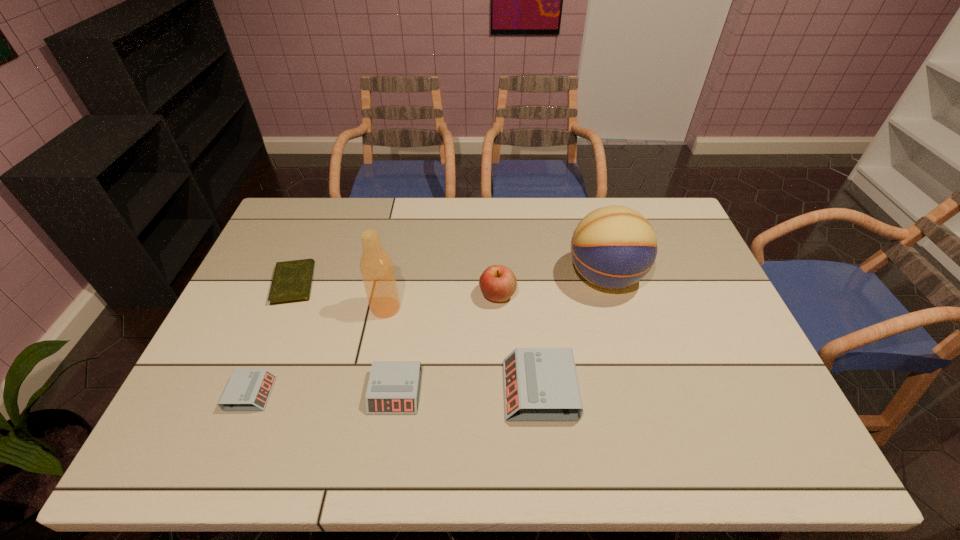
I want to click on vacant space situated 0.080m on the right of the leftmost alarm clock, so click(303, 394).

Locate an element on the screen. Image resolution: width=960 pixels, height=540 pixels. vacant space located 0.350m on the right of the second alarm clock from right to left is located at coordinates (560, 392).

At what (x,y) coordinates should I click in order to perform the action: click on vacant space situated on the left of the fourth shortest object. Please return your answer as a coordinate pair (x, y). This screenshot has width=960, height=540. Looking at the image, I should click on (448, 390).

Find the location of a particular element. The width and height of the screenshot is (960, 540). blank area located on the front of the shortest object is located at coordinates (275, 330).

Locate an element on the screen. This screenshot has height=540, width=960. vacant position located 0.120m on the patterned surface of the rightmost object is located at coordinates (528, 277).

Where is `vacant space located on the patterned surface of the rightmost object`? The width and height of the screenshot is (960, 540). vacant space located on the patterned surface of the rightmost object is located at coordinates (509, 277).

You are a GUI agent. You are given a task and a screenshot of the screen. Output one action in this format:
    pyautogui.click(x=<x>, y=<y>)
    Task: Click on the free space located on the patterned surface of the rightmost object
    This screenshot has width=960, height=540.
    Given the screenshot: What is the action you would take?
    pyautogui.click(x=524, y=277)

The image size is (960, 540). What are the coordinates of `vacant space located 0.400m on the left of the beer bottle` in the screenshot? It's located at (234, 308).

Where is `free space located 0.270m on the right of the apple`? free space located 0.270m on the right of the apple is located at coordinates (605, 295).

You are a GUI agent. You are given a task and a screenshot of the screen. Output one action in this format:
    pyautogui.click(x=<x>, y=<y>)
    Task: Click on the alarm clock that is positioned at the left edge
    
    Given the screenshot: What is the action you would take?
    pyautogui.click(x=247, y=389)